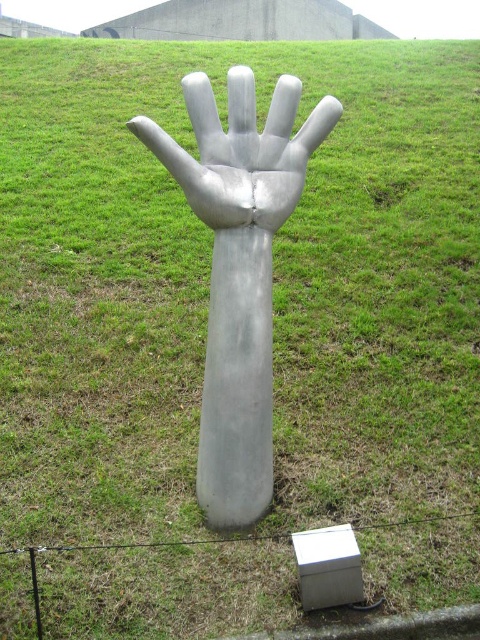
Who is positioned more to the left, silver metallic hand at center or shiny metallic hand at center?

From the viewer's perspective, silver metallic hand at center appears more on the left side.

Who is taller, silver metallic hand at center or shiny metallic hand at center?

With more height is silver metallic hand at center.

Is point (228, 77) farther from camera compared to point (278, 108)?

Yes, it is behind point (278, 108).

You are a GUI agent. You are given a task and a screenshot of the screen. Output one action in this format:
    pyautogui.click(x=<x>, y=<y>)
    Task: Click on the silver metallic hand at center
    This screenshot has width=480, height=640.
    Given the screenshot: What is the action you would take?
    pyautogui.click(x=239, y=269)